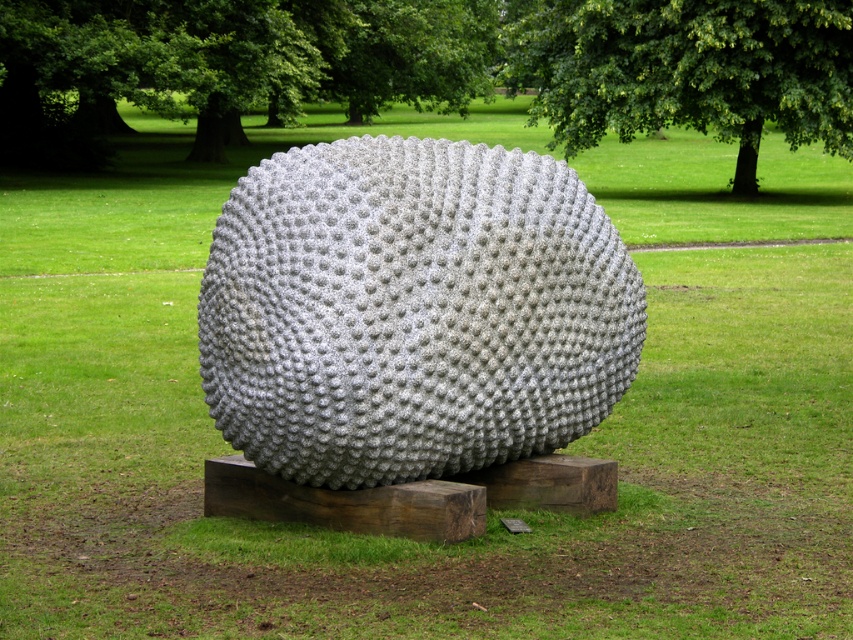
Who is higher up, sanded concrete sphere at center or green leafy tree at upper center?

green leafy tree at upper center

Is sanded concrete sphere at center closer to the viewer compared to green leafy tree at upper center?

Yes, it is in front of green leafy tree at upper center.

Is point (335, 333) more distant than point (798, 4)?

No.

Locate an element on the screen. Image resolution: width=853 pixels, height=640 pixels. sanded concrete sphere at center is located at coordinates (412, 310).